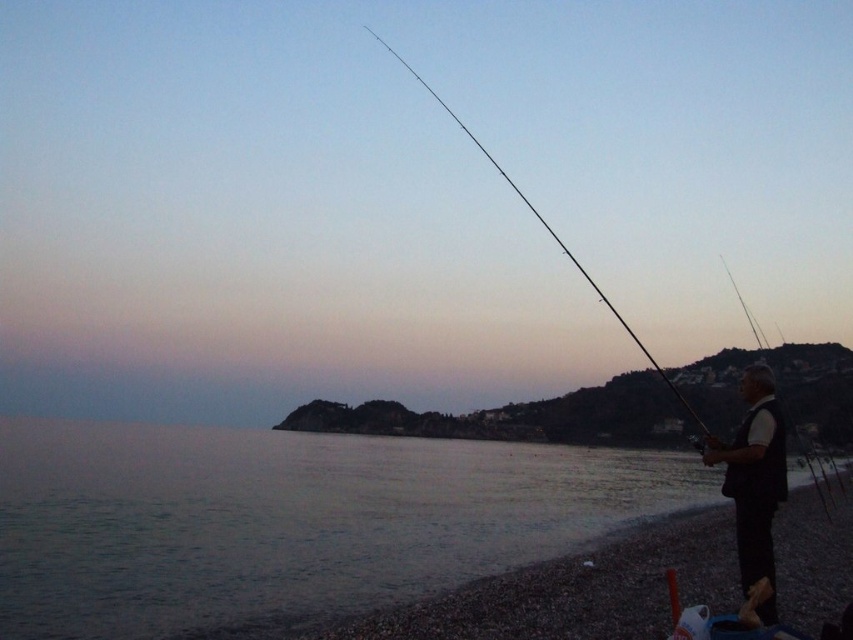
Question: Which of the following is the closest to the observer?

Choices:
 (A) (741, 300)
 (B) (635, 344)
 (C) (757, 452)
 (D) (364, 545)

Answer: (C)

Question: Does clear water at lower left have a smaller size compared to smooth black rod at right?

Choices:
 (A) no
 (B) yes

Answer: (B)

Question: Which of the following is the closest to the observer?

Choices:
 (A) black fabric vest at lower right
 (B) black rod fishing pole at center

Answer: (A)

Question: Does black fabric vest at lower right have a lesser width compared to black rod fishing pole at center?

Choices:
 (A) yes
 (B) no

Answer: (A)

Question: Can you confirm if black fabric vest at lower right is positioned above black rod fishing pole at center?

Choices:
 (A) yes
 (B) no

Answer: (B)

Question: Among these points, which one is nearest to the camera?

Choices:
 (A) (660, 374)
 (B) (749, 513)

Answer: (B)